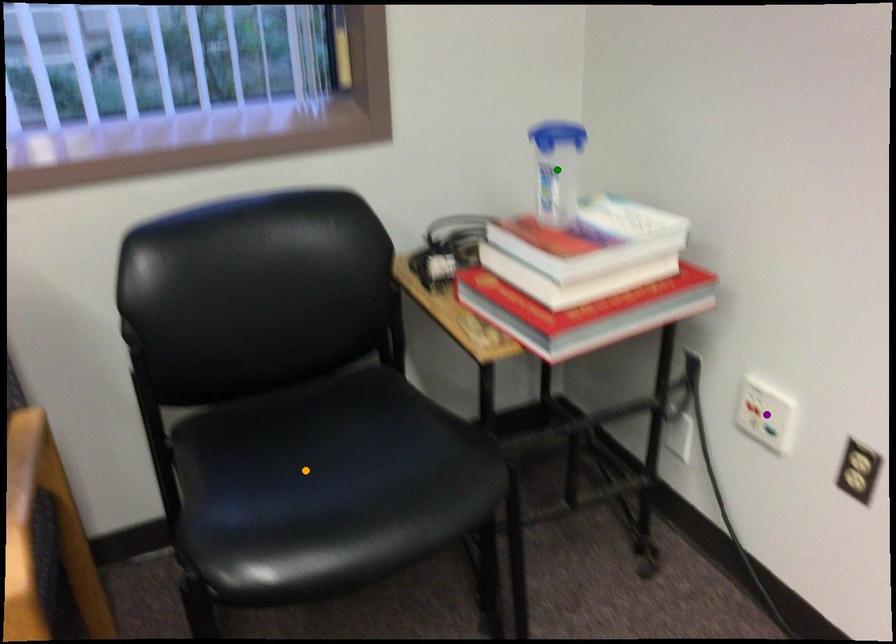
Order these from nearest to farthest:
purple point, green point, orange point

green point → purple point → orange point